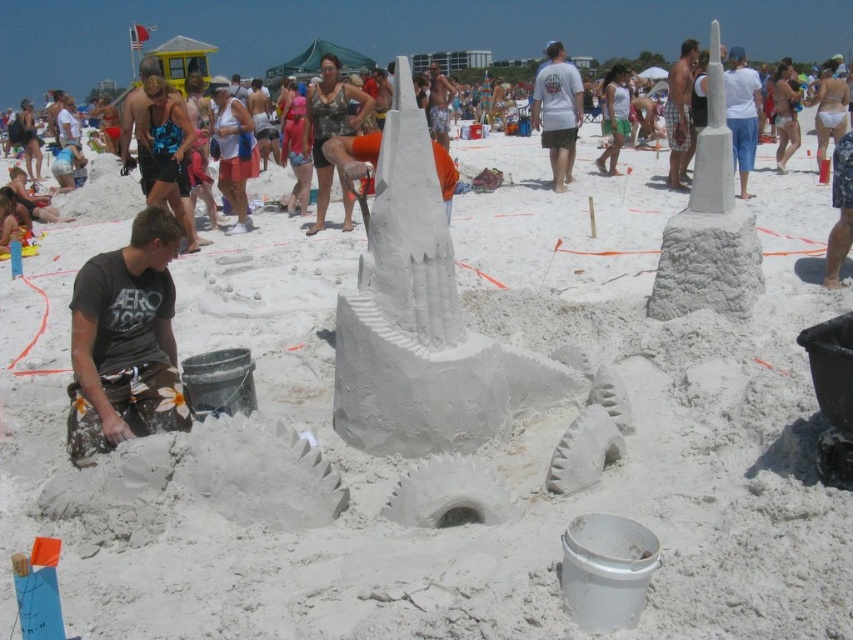
Question: Can you confirm if white cotton tank top at center is positioned above camouflage shorts at center?

Choices:
 (A) no
 (B) yes

Answer: (A)

Question: Which of the following is the farthest from the observer?

Choices:
 (A) (614, 141)
 (B) (544, 48)
 (C) (746, 120)
 (D) (161, 339)

Answer: (B)

Question: Considering the real-world distances, which object is closest to the plaid shorts at center?

Choices:
 (A) white cotton t-shirt at upper center
 (B) white cotton shirt at upper center
 (C) camouflage shorts at center
 (D) white cotton tank top at center

Answer: (B)

Question: Is the position of dark gray t-shirt at lower left less distant than that of white cotton tank top at center?

Choices:
 (A) no
 (B) yes

Answer: (B)

Question: Which of the following is the closest to the observer?

Choices:
 (A) white cotton shirt at upper center
 (B) camouflage shorts at center
 (C) dark gray t-shirt at lower left
 (D) white cotton tank top at center

Answer: (C)

Question: Does dark gray t-shirt at lower left appear under plaid shorts at center?

Choices:
 (A) no
 (B) yes

Answer: (B)